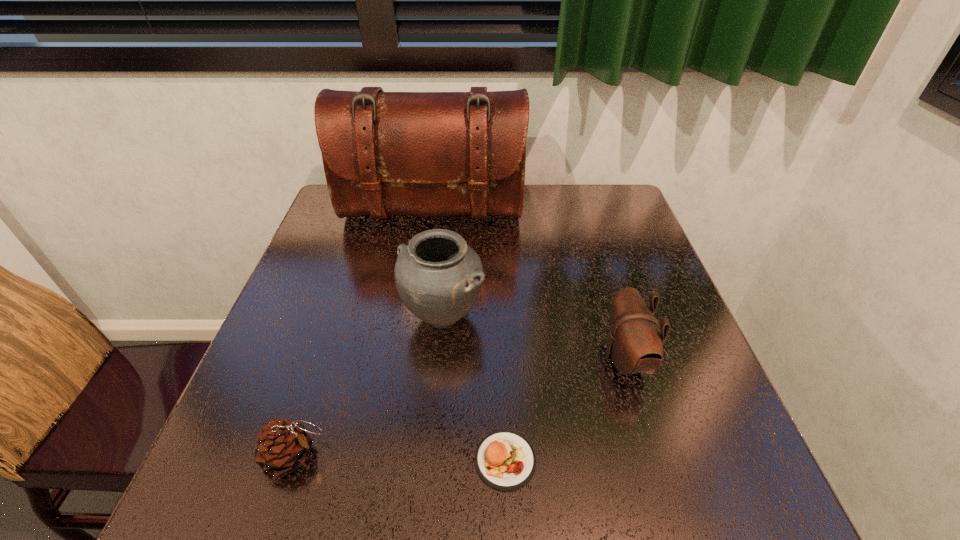
Find the location of a particular element. This screenshot has height=540, width=960. the farthest object is located at coordinates (384, 153).

This screenshot has width=960, height=540. In order to click on the tallest object in this screenshot , I will do `click(384, 153)`.

This screenshot has height=540, width=960. I want to click on the second tallest object, so click(x=438, y=277).

Locate an element on the screen. Image resolution: width=960 pixels, height=540 pixels. pouch is located at coordinates (635, 345).

Identify the location of the third shortest object. (635, 345).

Find the location of a particular element. The width and height of the screenshot is (960, 540). pinecone is located at coordinates (282, 446).

I want to click on patty (food), so click(x=505, y=460).

The width and height of the screenshot is (960, 540). What are the coordinates of `free region located on the front-facing side of the farthest object` in the screenshot? It's located at (421, 291).

I want to click on vacant space located 0.330m on the back of the urn, so click(x=452, y=212).

What are the coordinates of `vacant area situated 0.320m with the flap open on the rightmost object` in the screenshot? It's located at (446, 359).